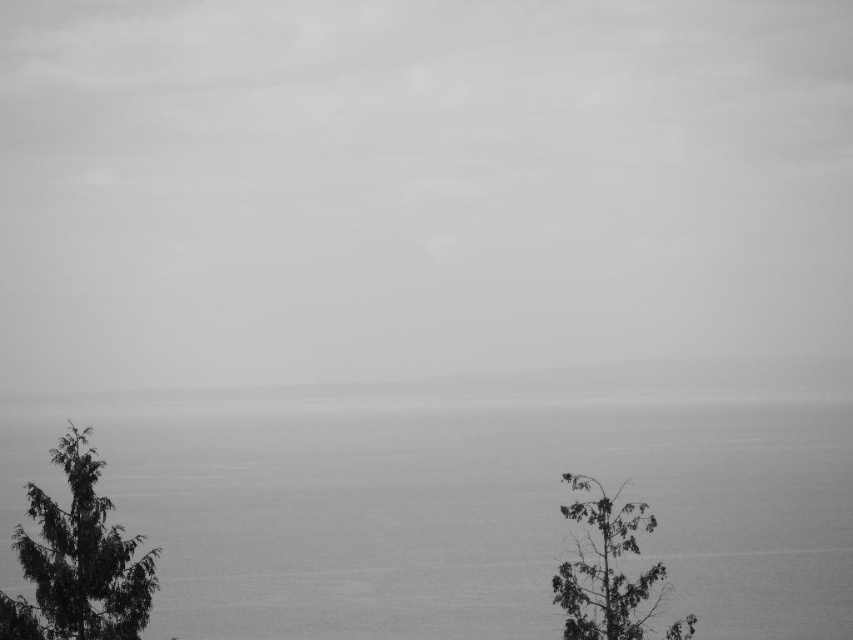
You are standing in front of the black and white landscape photo with the two trees. You see the point at (209, 524) and the point at (35, 554). Which point is closer to you?

Point (35, 554) is closer to you because it is less further to the camera than point (209, 524).

Looking at this image, you are a photographer trying to capture the entire scene in one shot. Given that your camera can only focus on objects within a 10m width, will the gray water at center and the dark green textured tree at lower left fit within the frame?

The gray water at center is wider than the dark green textured tree at lower left. Since the camera can focus on objects within a 10m width, both objects can fit within the frame as their combined width is less than 10m.